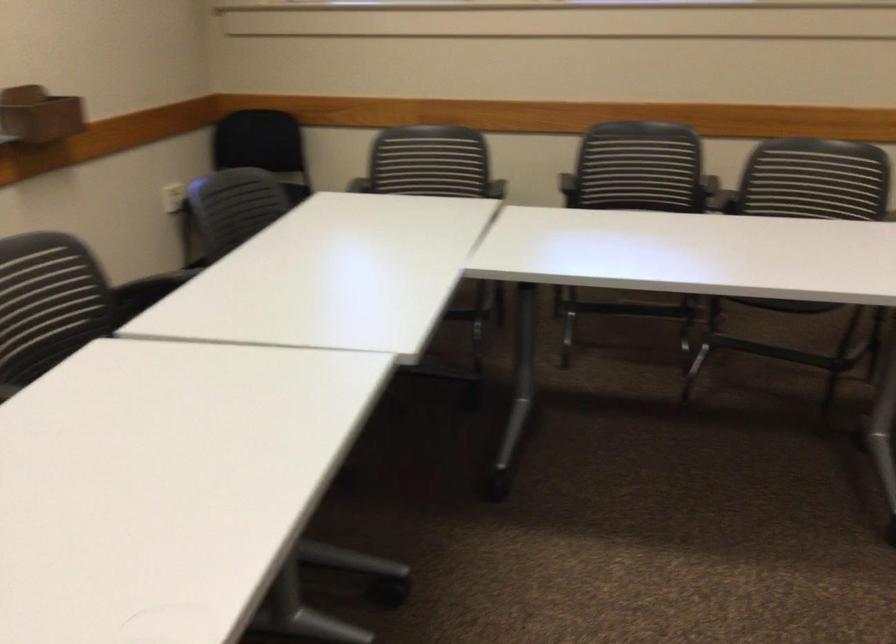
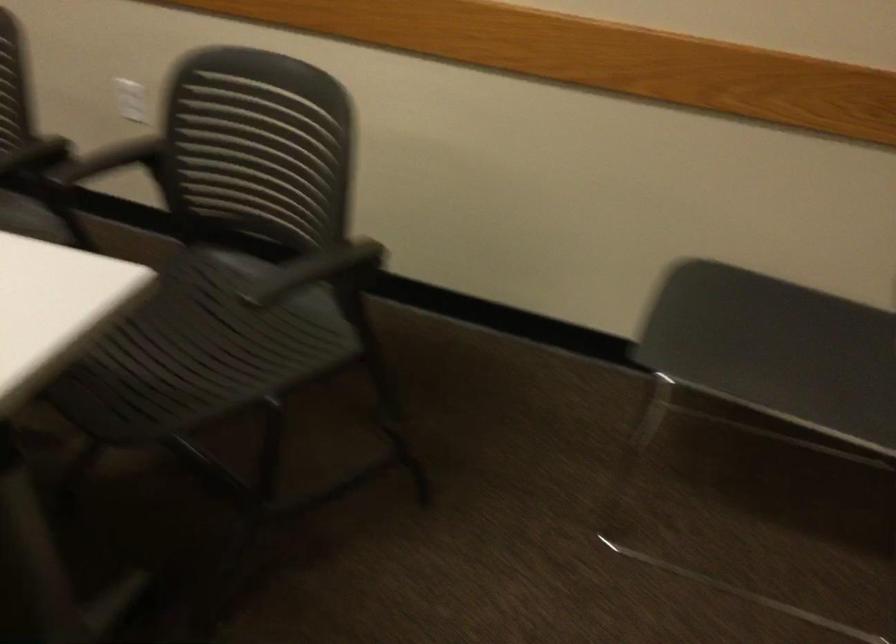
Question: In a continuous first-person perspective shot, in which direction is the camera moving?

Choices:
 (A) Left
 (B) Right
 (C) Forward
 (D) Backward

Answer: (B)